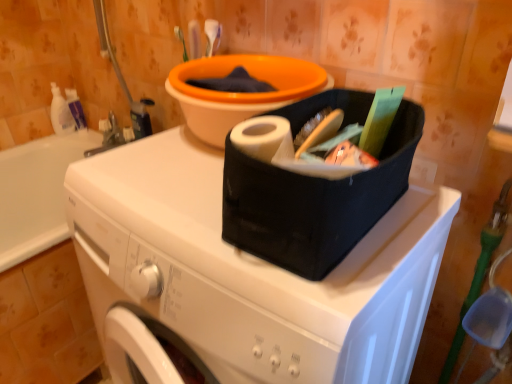
Question: In terms of height, does white matte washing machine at center look taller or shorter compared to white plastic bottle at upper left, which is the 2th cleaning product in left-to-right order?

Choices:
 (A) short
 (B) tall

Answer: (B)

Question: Does point click(x=150, y=279) appear closer or farther from the camera than point click(x=79, y=127)?

Choices:
 (A) closer
 (B) farther

Answer: (A)

Question: Which object is positioned farthest from the white glossy bottle at left, the 2th cleaning product viewed from the right?

Choices:
 (A) white matte washing machine at center
 (B) orange plastic basin at upper center
 (C) white plastic bottle at upper left, which is the 2th cleaning product in left-to-right order

Answer: (A)

Question: Estimate the real-world distances between objects in this image. Which object is farther from the orange plastic basin at upper center?

Choices:
 (A) white glossy bottle at left, the 2th cleaning product viewed from the right
 (B) white matte washing machine at center
 (C) white plastic bottle at upper left, marked as the 1th cleaning product in a right-to-left arrangement

Answer: (A)